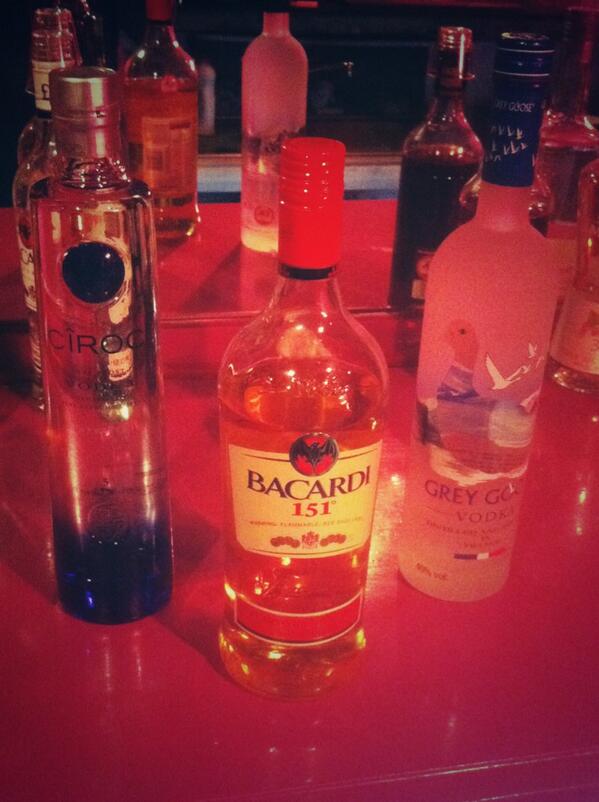
Where is `vodka bottle`? The height and width of the screenshot is (802, 599). vodka bottle is located at coordinates (81, 387).